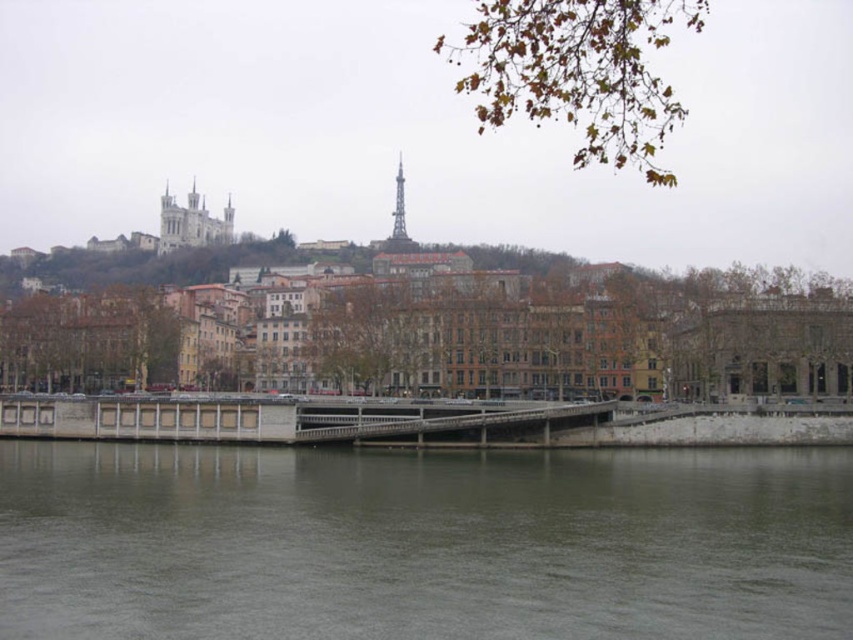
From the picture: You are a delivery drone with a wingspan of 50 feet. You need to fly from the gray concrete river at lower center to the concrete bridge at center. Can you safely pass between them without hitting either?

The gray concrete river at lower center and concrete bridge at center are 62.12 feet apart from each other. Since your wingspan is 50 feet, you have enough clearance to safely pass between them without any collision risk.

You are a delivery drone flying above the gray concrete river at lower center and the concrete bridge at center. To avoid collision, you need to know which object is lower in the scene. Which one is lower?

The gray concrete river at lower center is below the concrete bridge at center, so it is lower than the bridge.

You are a city planner assessing the riverside area. The gray concrete river at lower center and the concrete bridge at center are key elements. Based on their relative heights, which one is more likely to be visible from a higher vantage point overlooking the river?

The concrete bridge at center is more likely to be visible from a higher vantage point overlooking the river because it has a greater height than the gray concrete river at lower center.